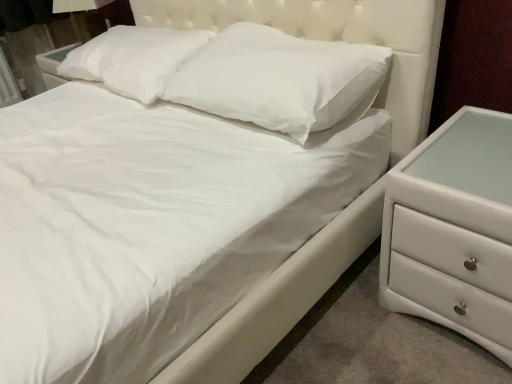
Question: Which direction should I rotate to look at white soft pillow at upper center, acting as the second pillow starting from the right, — up or down?

Choices:
 (A) down
 (B) up

Answer: (B)

Question: Is white glossy chest of drawers at right to the right of white soft pillow at center, the first pillow when ordered from right to left, from the viewer's perspective?

Choices:
 (A) yes
 (B) no

Answer: (A)

Question: Could you tell me if white glossy chest of drawers at right is turned towards white soft pillow at center, the first pillow when ordered from right to left?

Choices:
 (A) yes
 (B) no

Answer: (B)

Question: Considering the relative positions of white glossy chest of drawers at right and white soft pillow at center, positioned as the 2th pillow in left-to-right order, in the image provided, is white glossy chest of drawers at right behind white soft pillow at center, positioned as the 2th pillow in left-to-right order,?

Choices:
 (A) no
 (B) yes

Answer: (A)

Question: Can you confirm if white glossy chest of drawers at right is shorter than white soft pillow at center, the first pillow when ordered from right to left?

Choices:
 (A) no
 (B) yes

Answer: (A)

Question: Does white glossy chest of drawers at right have a smaller size compared to white soft pillow at center, positioned as the 2th pillow in left-to-right order?

Choices:
 (A) no
 (B) yes

Answer: (A)

Question: Does white glossy chest of drawers at right have a greater width compared to white soft pillow at center, positioned as the 2th pillow in left-to-right order?

Choices:
 (A) no
 (B) yes

Answer: (B)

Question: Is white soft pillow at upper center, acting as the second pillow starting from the right, positioned far away from white glossy chest of drawers at right?

Choices:
 (A) no
 (B) yes

Answer: (B)

Question: Is white soft pillow at upper center, acting as the second pillow starting from the right, shorter than white glossy chest of drawers at right?

Choices:
 (A) yes
 (B) no

Answer: (A)

Question: Considering the relative sizes of white soft pillow at upper center, acting as the 1th pillow starting from the left, and white glossy chest of drawers at right in the image provided, is white soft pillow at upper center, acting as the 1th pillow starting from the left, smaller than white glossy chest of drawers at right?

Choices:
 (A) no
 (B) yes

Answer: (B)

Question: From a real-world perspective, is white soft pillow at upper center, acting as the second pillow starting from the right, physically below white glossy chest of drawers at right?

Choices:
 (A) no
 (B) yes

Answer: (A)

Question: From the image's perspective, is white soft pillow at upper center, acting as the 1th pillow starting from the left, located above white glossy chest of drawers at right?

Choices:
 (A) no
 (B) yes

Answer: (B)

Question: Does white soft pillow at upper center, acting as the 1th pillow starting from the left, appear on the right side of white glossy chest of drawers at right?

Choices:
 (A) no
 (B) yes

Answer: (A)

Question: Does white soft pillow at upper center, acting as the second pillow starting from the right, have a lesser width compared to white soft pillow at center, positioned as the 2th pillow in left-to-right order?

Choices:
 (A) yes
 (B) no

Answer: (B)